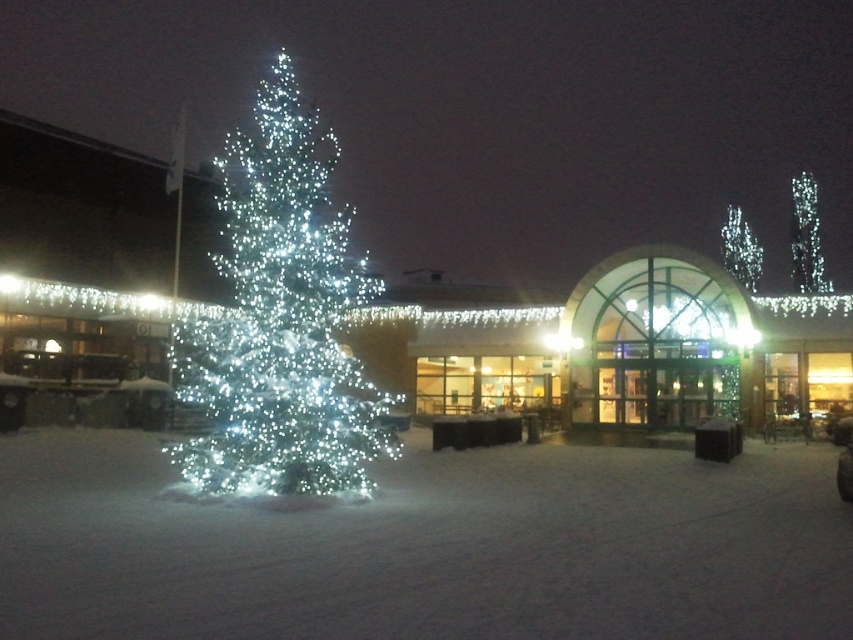
Question: Does icy white lights at left appear over icy white lights at center?

Choices:
 (A) yes
 (B) no

Answer: (A)

Question: Which of the following is the closest to the observer?

Choices:
 (A) icy white lights at center
 (B) icy white lights at left

Answer: (B)

Question: Which of the following is the farthest from the observer?

Choices:
 (A) (259, 360)
 (B) (811, 285)
 (C) (730, 205)

Answer: (C)

Question: Where is icy white lights at upper right located in relation to icy white lights at center in the image?

Choices:
 (A) below
 (B) above

Answer: (A)

Question: From the image, what is the correct spatial relationship of icy white lights at upper right in relation to icy white lights at center?

Choices:
 (A) left
 (B) right

Answer: (B)

Question: Among these objects, which one is nearest to the camera?

Choices:
 (A) icy white lights at center
 (B) icy white lights at left

Answer: (B)